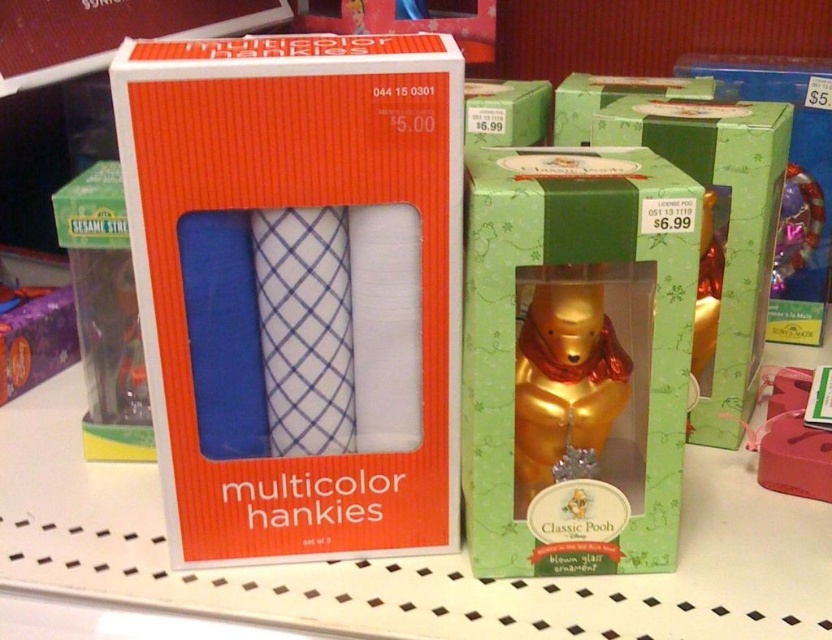
You are a customer looking at the retail display. You want to buy the gold glass ornament at center and the metallic gold bear at center. Which one is placed lower on the shelf?

The gold glass ornament at center is located below the metallic gold bear at center, so the gold glass ornament at center is placed lower on the shelf.

You are a customer at the store and want to buy both the orange matte box of multicolor hankies at center and the green paper box at center. If you start from the left side of the shelf, which box should you pick up first?

Since the orange matte box of multicolor hankies at center is to the left of the green paper box at center, you should pick up the orange matte box of multicolor hankies at center first when starting from the left side of the shelf.